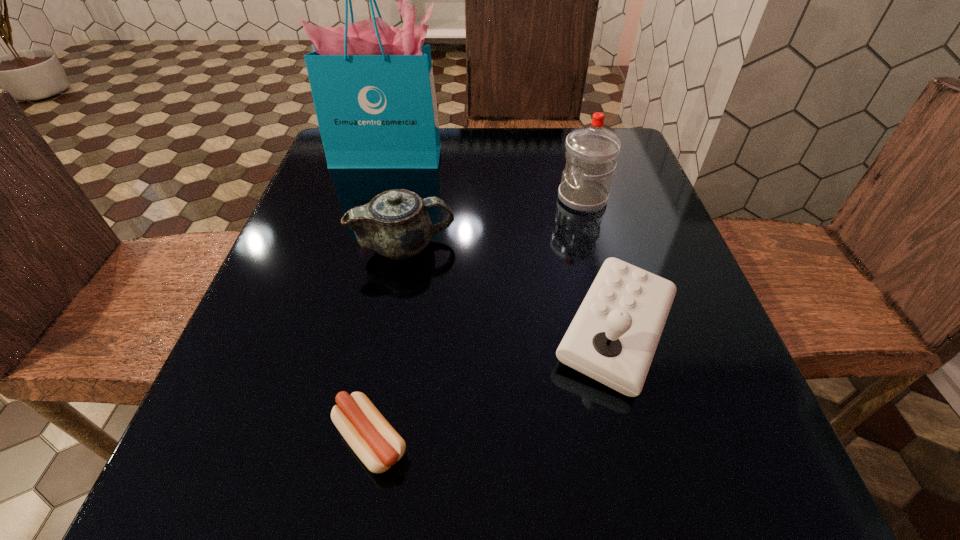
Locate an element on the screen. shopping bag is located at coordinates (372, 84).

Where is `the farthest object`? the farthest object is located at coordinates (372, 84).

I want to click on the second tallest object, so click(x=591, y=153).

Image resolution: width=960 pixels, height=540 pixels. I want to click on the fourth nearest object, so click(591, 153).

Where is `the third farthest object`? The image size is (960, 540). the third farthest object is located at coordinates (395, 223).

Where is `the second nearest object`? This screenshot has height=540, width=960. the second nearest object is located at coordinates (613, 337).

Identify the location of sausage. This screenshot has height=540, width=960. (376, 443).

Image resolution: width=960 pixels, height=540 pixels. Find the location of `the nearest object`. the nearest object is located at coordinates (x=376, y=443).

Locate an element on the screen. blank area located on the right of the tallest object is located at coordinates (537, 157).

Locate an element on the screen. The width and height of the screenshot is (960, 540). vacant area situated on the handle side of the water bottle is located at coordinates (460, 198).